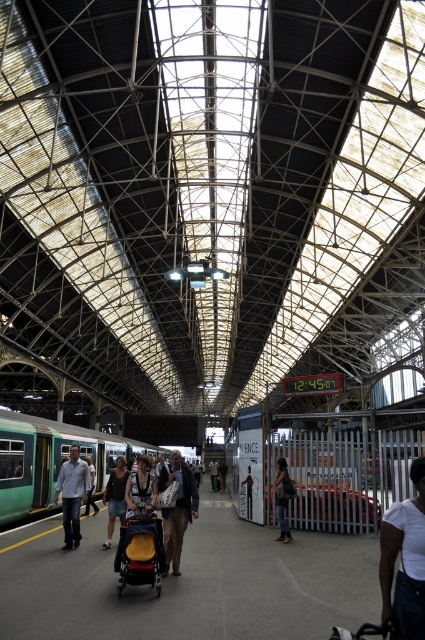
Is white matte train at center above dark gray fabric backpack at center?

No.

Between white matte train at center and dark gray fabric backpack at center, which one has less height?

Standing shorter between the two is dark gray fabric backpack at center.

This screenshot has height=640, width=425. Identify the location of white matte train at center. (309, 474).

Is light blue shirt at left positioned in front of dark gray fabric backpack at center?

Yes, light blue shirt at left is in front of dark gray fabric backpack at center.

Can you confirm if light blue shirt at left is shorter than dark gray fabric backpack at center?

In fact, light blue shirt at left may be taller than dark gray fabric backpack at center.

Does point (82, 481) come in front of point (289, 496)?

Yes.

Identify the location of light blue shirt at left. (71, 493).

Does white matte train at center have a greater height compared to green matte train at center?

No, white matte train at center is not taller than green matte train at center.

Consider the image. Between white matte train at center and green matte train at center, which one appears on the left side from the viewer's perspective?

green matte train at center

Who is more forward, (345, 442) or (10, 476)?

Point (10, 476) is in front.

Find the location of `white matte train at center`. white matte train at center is located at coordinates (309, 474).